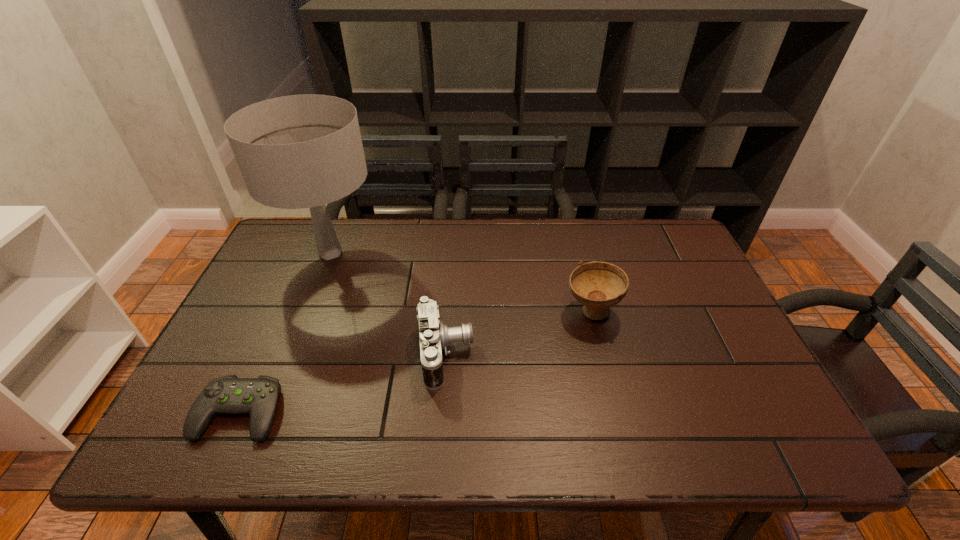
The width and height of the screenshot is (960, 540). In order to click on the tallest object in this screenshot , I will do `click(301, 151)`.

This screenshot has height=540, width=960. I want to click on the farthest object, so click(x=301, y=151).

Where is `soup bowl`? The image size is (960, 540). soup bowl is located at coordinates (598, 286).

This screenshot has width=960, height=540. Identify the location of the second object from right to left. (434, 336).

Find the location of a particular element. The image size is (960, 540). camera is located at coordinates click(434, 336).

In order to click on control in this screenshot , I will do `click(258, 397)`.

At what (x,y) coordinates should I click in order to perform the action: click on free point located 0.280m on the front-facing side of the farthest object. Please return your answer as a coordinate pair (x, y). This screenshot has height=540, width=960. Looking at the image, I should click on (285, 367).

Find the location of `vacant space located on the front of the soup bowl`. vacant space located on the front of the soup bowl is located at coordinates click(x=602, y=352).

At what (x,y) coordinates should I click in order to perform the action: click on free region located at the lens of the third tallest object. Please return your answer as a coordinate pair (x, y). This screenshot has height=540, width=960. Looking at the image, I should click on (608, 354).

Find the location of `vacant area situated 0.290m on the right of the control`. vacant area situated 0.290m on the right of the control is located at coordinates (413, 413).